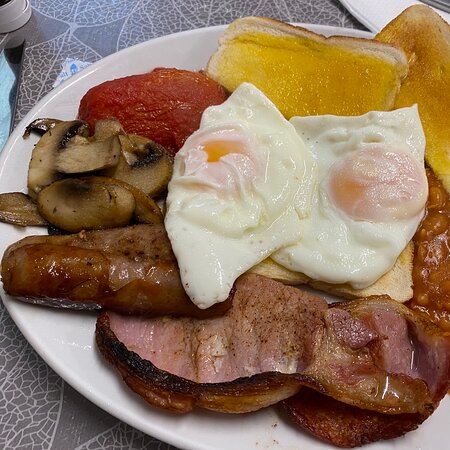
Locate an element on the screen. The image size is (450, 450). table cloth is located at coordinates (139, 16).